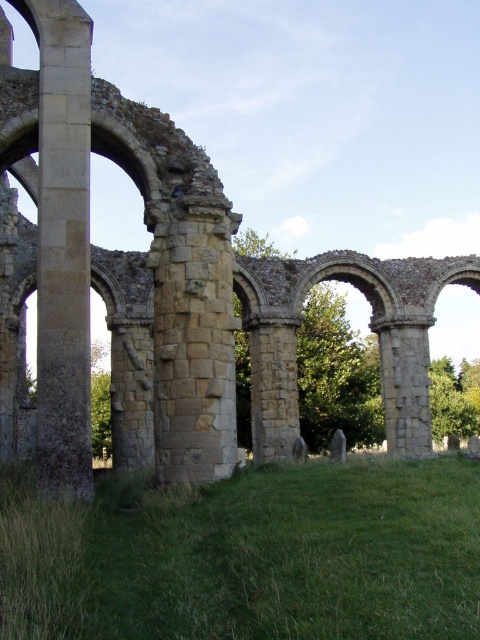
Can you confirm if green grass at lower center is positioned to the left of smooth stone pillar at left?

Incorrect, green grass at lower center is not on the left side of smooth stone pillar at left.

Does point (61, 586) lie behind point (39, 342)?

No, it is not.

The height and width of the screenshot is (640, 480). Find the location of `green grass at lower center`. green grass at lower center is located at coordinates (249, 554).